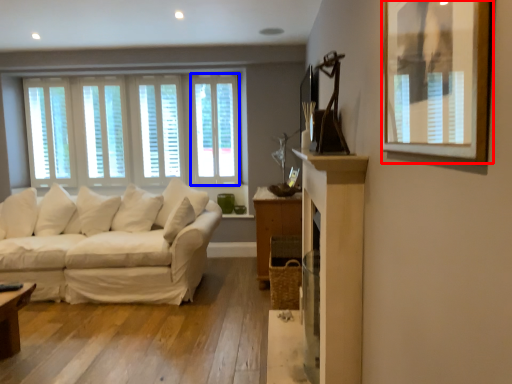
Question: Which point is further to the camera, picture frame (highlighted by a red box) or window (highlighted by a blue box)?

Choices:
 (A) picture frame
 (B) window

Answer: (B)